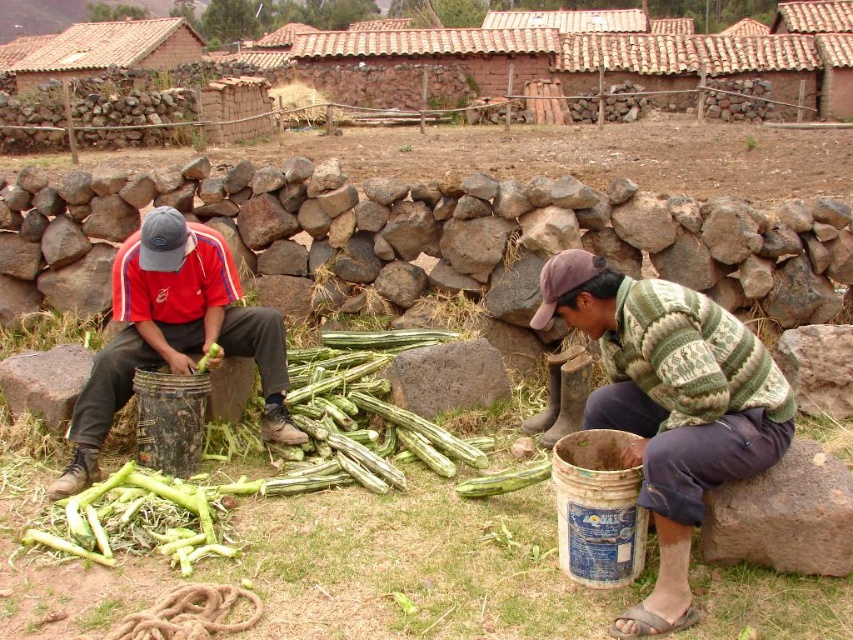
Question: Does green knitted sweater at lower right have a greater width compared to matte black bucket at left?

Choices:
 (A) no
 (B) yes

Answer: (A)

Question: Can you confirm if matte black bucket at left is thinner than green matte vegetable at center?

Choices:
 (A) yes
 (B) no

Answer: (B)

Question: Which object is the closest to the matte black bucket at left?

Choices:
 (A) green rough vegetable at center
 (B) green knitted sweater at lower right
 (C) green matte vegetable at center

Answer: (C)

Question: From the image, what is the correct spatial relationship of green rough vegetable at center in relation to green matte vegetable at center?

Choices:
 (A) below
 (B) above

Answer: (A)

Question: Based on their relative distances, which object is nearer to the green matte vegetable at center?

Choices:
 (A) matte black bucket at left
 (B) green knitted sweater at lower right

Answer: (A)

Question: Which point appears closest to the camera in this image?

Choices:
 (A) (131, 356)
 (B) (190, 515)
 (C) (733, 422)
 (D) (199, 362)

Answer: (C)